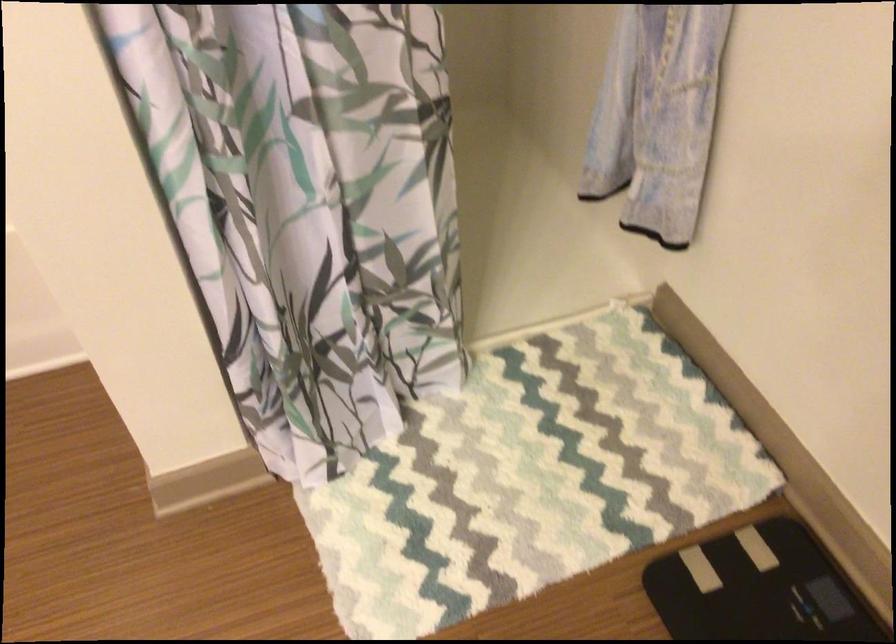
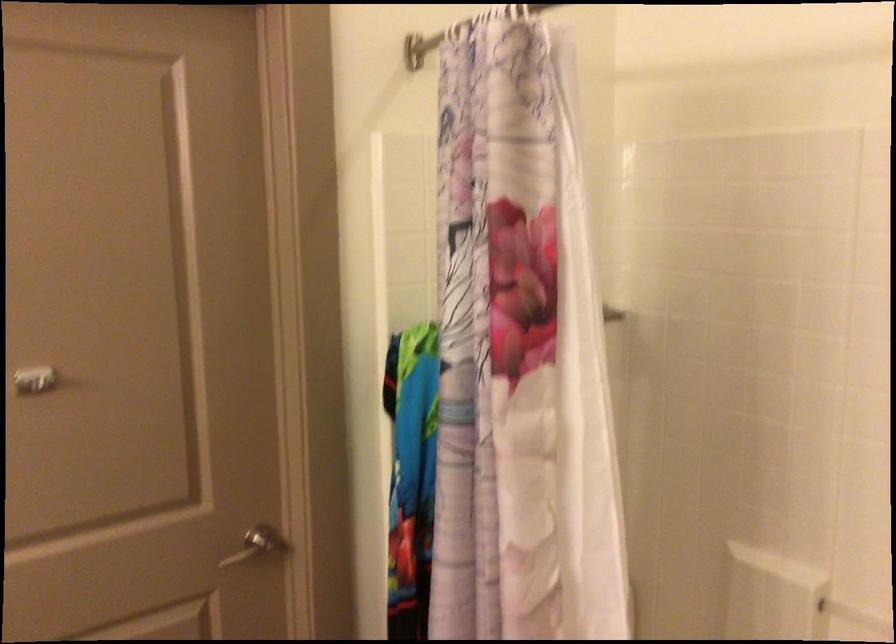
Question: The images are taken continuously from a first-person perspective. In which direction is your viewpoint rotating?

Choices:
 (A) Left
 (B) Right
 (C) Up
 (D) Down

Answer: (A)